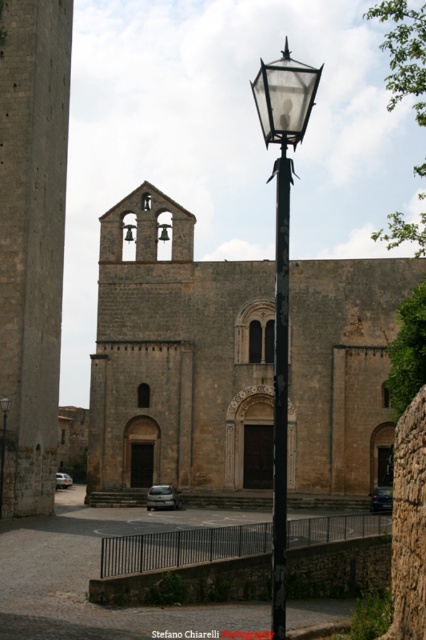
Between matte black street light at center and metallic bell at center, which one has less height?

metallic bell at center

Is matte black street light at center behind metallic bell at center?

No.

Identify the location of matte black street light at center. This screenshot has height=640, width=426. (2, 445).

Between gray stone tower at left and silver metallic car at center, which one appears on the right side from the viewer's perspective?

gray stone tower at left

This screenshot has height=640, width=426. What do you see at coordinates (31, 241) in the screenshot?
I see `gray stone tower at left` at bounding box center [31, 241].

I want to click on gray stone tower at left, so click(31, 241).

Find the location of a particular element. The height and width of the screenshot is (640, 426). gray stone tower at left is located at coordinates (31, 241).

Between point (271, 348) and point (131, 234), which one is positioned in front?

Point (271, 348) is more forward.

Looking at this image, who is more forward, (x=212, y=264) or (x=129, y=236)?

Point (x=212, y=264) is more forward.

What are the coordinates of `brown stone church at center` in the screenshot? It's located at (178, 362).